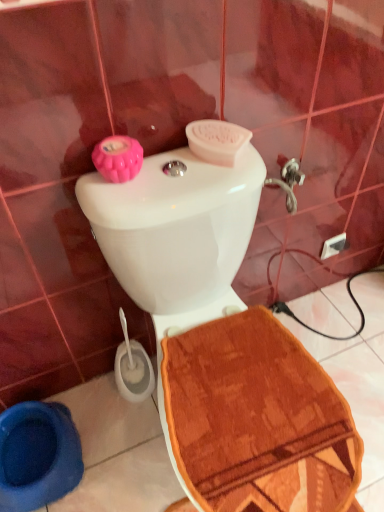
I want to click on empty space that is to the right of blue rubber toilet bowl at lower left, so click(x=120, y=448).